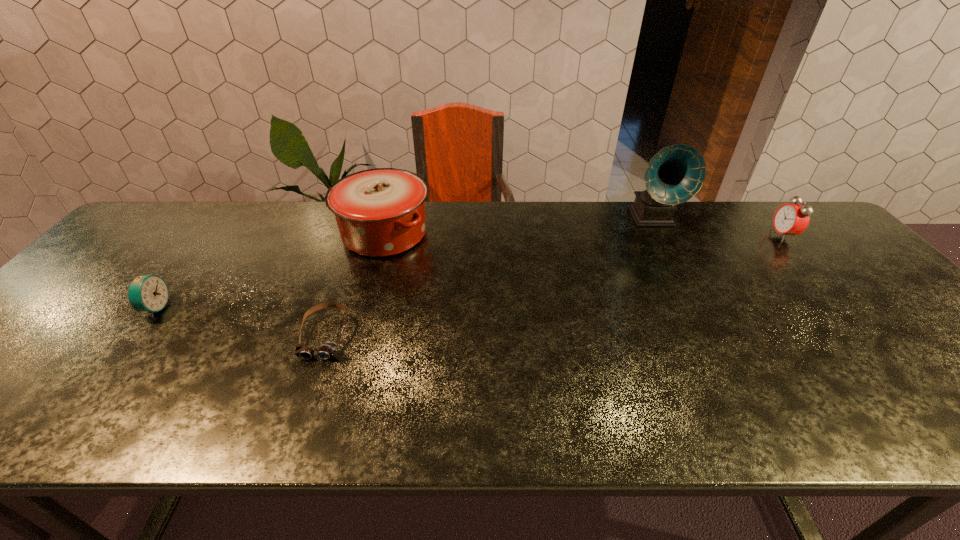
Where is `the fourth object from left to right`? Image resolution: width=960 pixels, height=540 pixels. the fourth object from left to right is located at coordinates (675, 174).

The height and width of the screenshot is (540, 960). What are the coordinates of `phonograph_record` in the screenshot? It's located at (675, 174).

In order to click on casserole in this screenshot , I will do `click(380, 212)`.

Where is `the right alarm clock`? the right alarm clock is located at coordinates (791, 219).

Image resolution: width=960 pixels, height=540 pixels. I want to click on the taller alarm clock, so click(x=791, y=219).

Locate an element on the screen. Image resolution: width=960 pixels, height=540 pixels. the left alarm clock is located at coordinates (147, 293).

Locate an element on the screen. the nearer alarm clock is located at coordinates (147, 293).

The height and width of the screenshot is (540, 960). Find the location of `the shortest object`. the shortest object is located at coordinates (327, 350).

Locate an element on the screen. Image resolution: width=960 pixels, height=540 pixels. free space located from the horn of the phonograph_record is located at coordinates (700, 310).

Where is `vacant space located 0.360m on the right of the casserole`? This screenshot has width=960, height=540. vacant space located 0.360m on the right of the casserole is located at coordinates (552, 234).